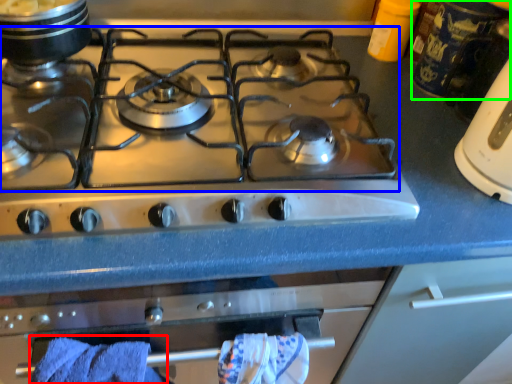
Question: Based on their relative distances, which object is farther from bath towel (highlighted by a red box)? Choose from gas stove (highlighted by a blue box) and appliance (highlighted by a green box).

Choices:
 (A) gas stove
 (B) appliance

Answer: (B)